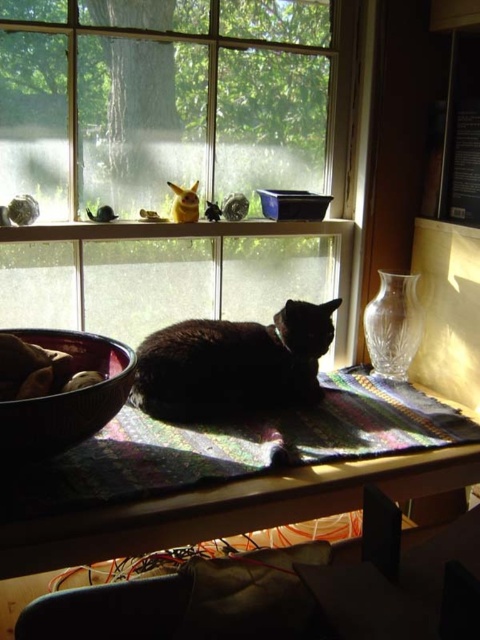
Can you confirm if multicolored woven mat at center is thinner than black fur cat at center?

Incorrect, multicolored woven mat at center's width is not less than black fur cat at center's.

Can you confirm if multicolored woven mat at center is positioned below black fur cat at center?

Yes.

Which is behind, point (429, 412) or point (148, 346)?

The point (429, 412) is more distant.

The height and width of the screenshot is (640, 480). What are the coordinates of `multicolored woven mat at center` in the screenshot? It's located at 232,448.

Does point (278, 19) come closer to viewer compared to point (57, 340)?

No, it is not.

Who is taller, transparent glass window at upper center or brown matte bowl at lower left?

transparent glass window at upper center is taller.

This screenshot has width=480, height=640. What do you see at coordinates (176, 157) in the screenshot? I see `transparent glass window at upper center` at bounding box center [176, 157].

Where is `transparent glass window at upper center`? transparent glass window at upper center is located at coordinates (176, 157).

Who is lower down, transparent glass window at upper center or multicolored woven mat at center?

multicolored woven mat at center

Who is more forward, (x=181, y=141) or (x=21, y=470)?

Positioned in front is point (x=21, y=470).

Does point (321, 163) lie behind point (468, 438)?

Yes, point (321, 163) is behind point (468, 438).

Locate an element on the screen. transparent glass window at upper center is located at coordinates (176, 157).